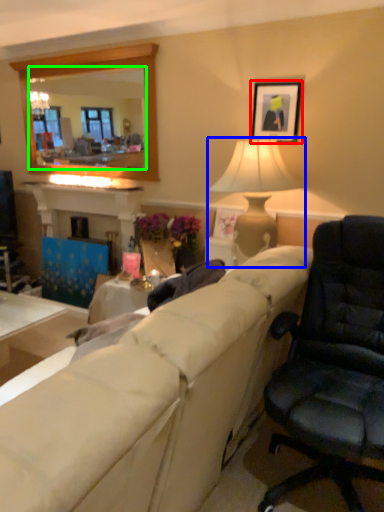
Question: Considering the real-world distances, which object is closest to picture frame (highlighted by a red box)? lamp (highlighted by a blue box) or mirror (highlighted by a green box).

Choices:
 (A) lamp
 (B) mirror

Answer: (A)